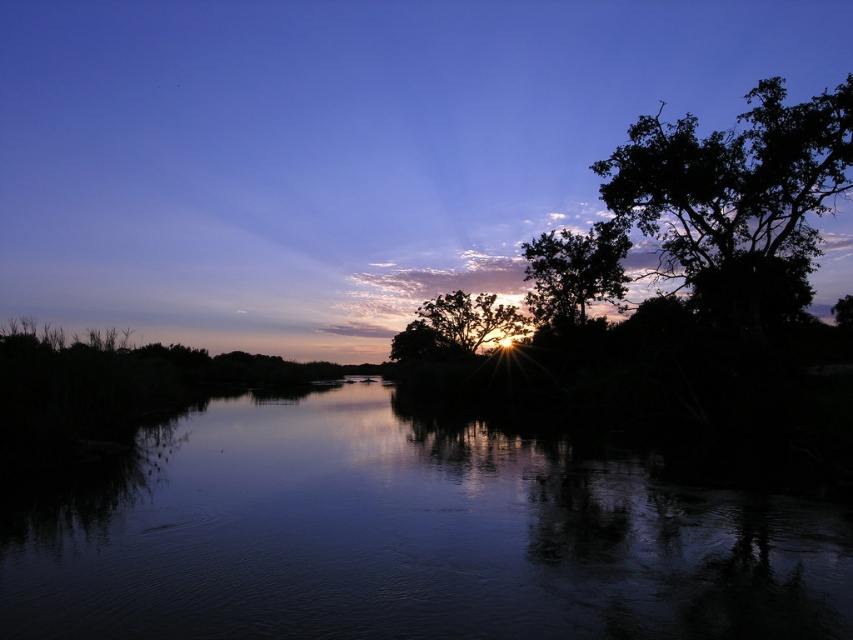
You are an artist trying to paint this sunset scene. You want to ensure the smooth water at center and the green leafy tree at center are proportionally accurate. Which one should you make wider in your painting?

The smooth water at center should be made wider in the painting since its width is larger than the green leafy tree at center according to the description.